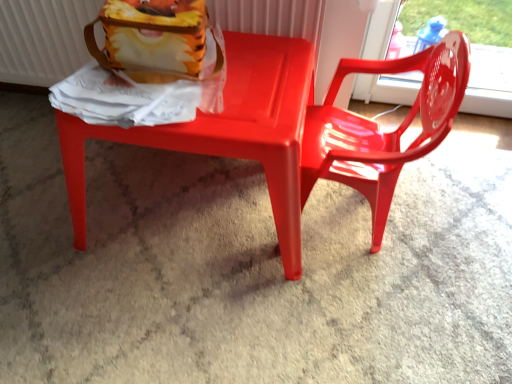
Question: Do you think matte white radiator at upper left is within glossy plastic chair at center, which is the second chair in left-to-right order, or outside of it?

Choices:
 (A) inside
 (B) outside

Answer: (B)

Question: In the image, is matte white radiator at upper left positioned in front of or behind glossy plastic chair at center, the first chair positioned from the right?

Choices:
 (A) front
 (B) behind

Answer: (B)

Question: Which is nearer to the matte plastic chair at center, which is counted as the 1th chair, starting from the left?

Choices:
 (A) glossy plastic chair at center, the first chair positioned from the right
 (B) matte white radiator at upper left

Answer: (A)

Question: Estimate the real-world distances between objects in this image. Which object is closer to the glossy plastic chair at center, the first chair positioned from the right?

Choices:
 (A) matte white radiator at upper left
 (B) matte plastic chair at center, the 2th chair positioned from the right

Answer: (B)